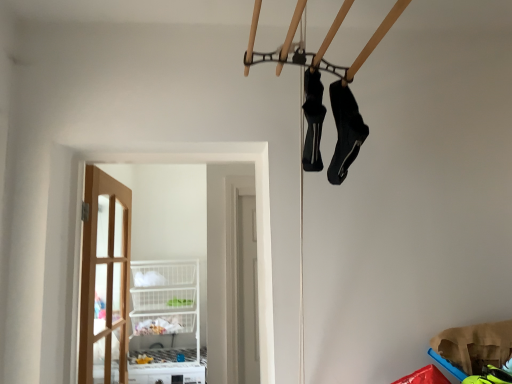
At what (x,y) coordinates should I click in order to perform the action: click on wooden door at left. Please return your answer as a coordinate pair (x, y). The width and height of the screenshot is (512, 384). Looking at the image, I should click on (105, 279).

How many degrees apart are the facing directions of clear glass door at center and black synthetic socks at upper right, which is the 1th footwear from right to left?

89.1 degrees.

Between clear glass door at center and black synthetic socks at upper right, arranged as the second footwear when viewed from the left, which one has smaller width?

black synthetic socks at upper right, arranged as the second footwear when viewed from the left.

From the image's perspective, which is above, clear glass door at center or black synthetic socks at upper right, arranged as the second footwear when viewed from the left?

black synthetic socks at upper right, arranged as the second footwear when viewed from the left.

Between clear glass door at center and black synthetic socks at upper right, which is the 1th footwear from right to left, which one has more height?

clear glass door at center is taller.

From the image's perspective, between black synthetic socks at upper right, which is the 1th footwear from right to left, and wooden door at left, who is located below?

wooden door at left, from the image's perspective.

From a real-world perspective, is black synthetic socks at upper right, which is the 1th footwear from right to left, under wooden door at left?

No, from a real-world perspective, black synthetic socks at upper right, which is the 1th footwear from right to left, is not under wooden door at left.

Is black synthetic socks at upper right, arranged as the second footwear when viewed from the left, in front of wooden door at left?

Yes, it is.

Looking at this image, would you say wooden door at left is part of black synthetic socks at upper right, arranged as the second footwear when viewed from the left,'s contents?

Definitely not — wooden door at left is not inside black synthetic socks at upper right, arranged as the second footwear when viewed from the left.

Would you say clear glass door at center contains black matte shoe at center, placed as the 2th footwear when sorted from right to left?

No, black matte shoe at center, placed as the 2th footwear when sorted from right to left, is not surrounded by clear glass door at center.

Which object is closer to the camera taking this photo, clear glass door at center or black matte shoe at center, placed as the 2th footwear when sorted from right to left?

black matte shoe at center, placed as the 2th footwear when sorted from right to left.

Is clear glass door at center to the right of black matte shoe at center, acting as the 1th footwear starting from the left, from the viewer's perspective?

No, clear glass door at center is not to the right of black matte shoe at center, acting as the 1th footwear starting from the left.

From the image's perspective, which object appears higher, clear glass door at center or black matte shoe at center, acting as the 1th footwear starting from the left?

black matte shoe at center, acting as the 1th footwear starting from the left.

Looking at this image, is wooden door at left positioned with its back to black matte shoe at center, placed as the 2th footwear when sorted from right to left?

No, wooden door at left is not facing the opposite direction of black matte shoe at center, placed as the 2th footwear when sorted from right to left.

This screenshot has height=384, width=512. Identify the location of the 1st footwear in front when counting from the wooden door at left. (313, 120).

Would you say wooden door at left is to the left or to the right of black matte shoe at center, placed as the 2th footwear when sorted from right to left, in the picture?

From the image, it's evident that wooden door at left is to the left of black matte shoe at center, placed as the 2th footwear when sorted from right to left.

From the image's perspective, between wooden door at left and black matte shoe at center, placed as the 2th footwear when sorted from right to left, which one is located above?

black matte shoe at center, placed as the 2th footwear when sorted from right to left, is shown above in the image.

Are wooden door at left and black synthetic socks at upper right, which is the 1th footwear from right to left, making contact?

No, wooden door at left is not with black synthetic socks at upper right, which is the 1th footwear from right to left.

Could you tell me if wooden door at left is facing black synthetic socks at upper right, arranged as the second footwear when viewed from the left?

No, wooden door at left is not aimed at black synthetic socks at upper right, arranged as the second footwear when viewed from the left.

Which is in front, point (106, 240) or point (341, 136)?

Positioned in front is point (341, 136).

At what (x,y) coordinates should I click in order to perform the action: click on footwear in front of the black matte shoe at center, placed as the 2th footwear when sorted from right to left. Please return your answer as a coordinate pair (x, y). This screenshot has width=512, height=384. Looking at the image, I should click on (345, 131).

Based on the photo, which is less distant, [333,171] or [308,168]?

Point [308,168]

From a real-world perspective, relative to black matte shoe at center, acting as the 1th footwear starting from the left, is black synthetic socks at upper right, arranged as the second footwear when viewed from the left, vertically above or below?

black synthetic socks at upper right, arranged as the second footwear when viewed from the left, is situated lower than black matte shoe at center, acting as the 1th footwear starting from the left, in the real world.

Is wooden door at left positioned beyond the bounds of clear glass door at center?

Indeed, wooden door at left is completely outside clear glass door at center.

Which object is further away from the camera, wooden door at left or clear glass door at center?

wooden door at left is further from the camera.

From a real-world perspective, is wooden door at left located beneath clear glass door at center?

Yes.

Between wooden door at left and clear glass door at center, which one has less height?

clear glass door at center is shorter.

Image resolution: width=512 pixels, height=384 pixels. Identify the location of footwear that is the 2nd object to the right of the clear glass door at center, starting at the anchor. (345, 131).

The image size is (512, 384). Identify the location of door that appears below the black synthetic socks at upper right, arranged as the second footwear when viewed from the left (from a real-world perspective). (105, 279).

From the image, which object appears to be nearer to black matte shoe at center, placed as the 2th footwear when sorted from right to left, clear glass door at center or wooden door at left?

clear glass door at center lies closer to black matte shoe at center, placed as the 2th footwear when sorted from right to left, than the other object.

Looking at the image, which one is located closer to wooden door at left, clear glass door at center or black matte shoe at center, placed as the 2th footwear when sorted from right to left?

Among the two, clear glass door at center is located nearer to wooden door at left.

Looking at the image, which one is located closer to clear glass door at center, wooden door at left or black synthetic socks at upper right, arranged as the second footwear when viewed from the left?

black synthetic socks at upper right, arranged as the second footwear when viewed from the left.

Which object lies further to the anchor point clear glass door at center, black matte shoe at center, placed as the 2th footwear when sorted from right to left, or black synthetic socks at upper right, which is the 1th footwear from right to left?

black synthetic socks at upper right, which is the 1th footwear from right to left, lies further to clear glass door at center than the other object.

Based on their spatial positions, is clear glass door at center or black synthetic socks at upper right, which is the 1th footwear from right to left, further from wooden door at left?

The object further to wooden door at left is black synthetic socks at upper right, which is the 1th footwear from right to left.

When comparing their distances from black synthetic socks at upper right, which is the 1th footwear from right to left, does clear glass door at center or black matte shoe at center, placed as the 2th footwear when sorted from right to left, seem further?

clear glass door at center is further to black synthetic socks at upper right, which is the 1th footwear from right to left.

Based on their spatial positions, is black synthetic socks at upper right, which is the 1th footwear from right to left, or clear glass door at center further from wooden door at left?

black synthetic socks at upper right, which is the 1th footwear from right to left, is further to wooden door at left.

Looking at the image, which one is located closer to black synthetic socks at upper right, which is the 1th footwear from right to left, wooden door at left or black matte shoe at center, acting as the 1th footwear starting from the left?

Based on the image, black matte shoe at center, acting as the 1th footwear starting from the left, appears to be nearer to black synthetic socks at upper right, which is the 1th footwear from right to left.

Locate an element on the screen. footwear between wooden door at left and black synthetic socks at upper right, which is the 1th footwear from right to left is located at coordinates (313, 120).

Find the location of a particular element. This screenshot has height=384, width=512. window between wooden door at left and black synthetic socks at upper right, arranged as the second footwear when viewed from the left, from left to right is located at coordinates (256, 212).

Find the location of a particular element. The height and width of the screenshot is (384, 512). footwear between clear glass door at center and black synthetic socks at upper right, arranged as the second footwear when viewed from the left, in the horizontal direction is located at coordinates (313, 120).

Locate an element on the screen. window between wooden door at left and black matte shoe at center, placed as the 2th footwear when sorted from right to left, in the horizontal direction is located at coordinates (256, 212).